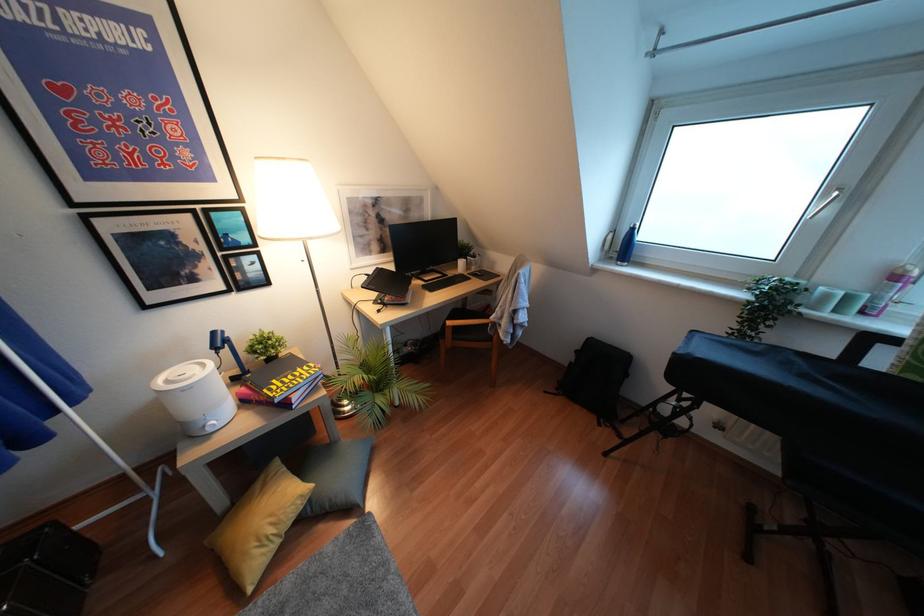
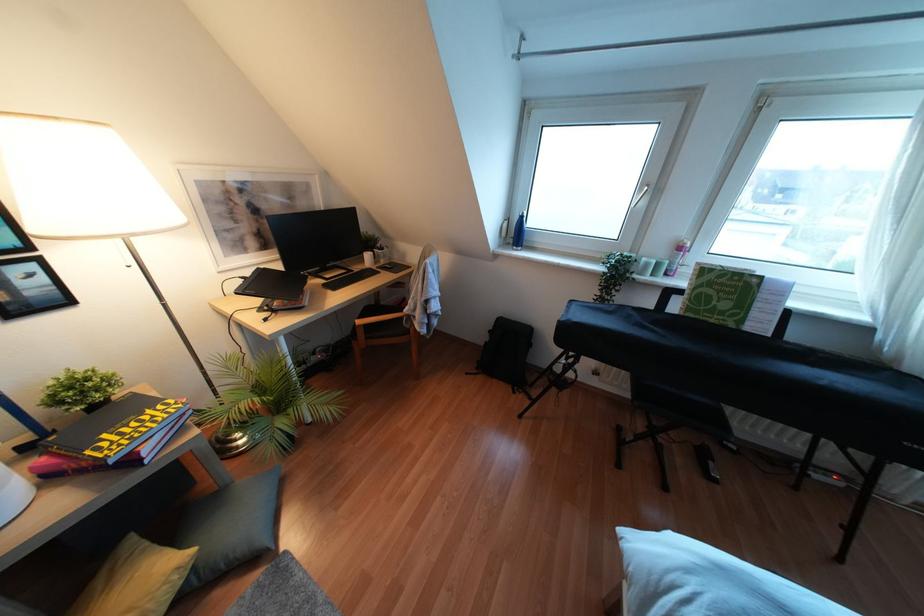
Question: The images are taken continuously from a first-person perspective. In which direction is your viewpoint rotating?

Choices:
 (A) Left
 (B) Right
 (C) Up
 (D) Down

Answer: (B)